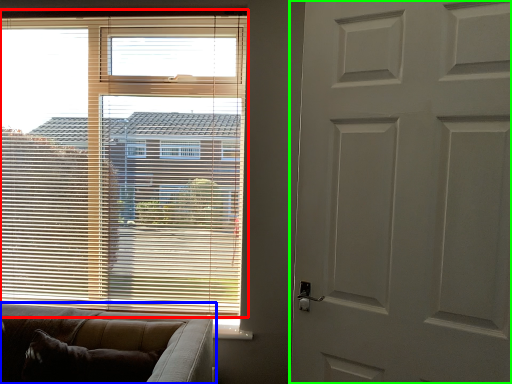
Question: Considering the real-world distances, which object is farthest from window blind (highlighted by a red box)? studio couch (highlighted by a blue box) or door (highlighted by a green box)?

Choices:
 (A) studio couch
 (B) door

Answer: (B)